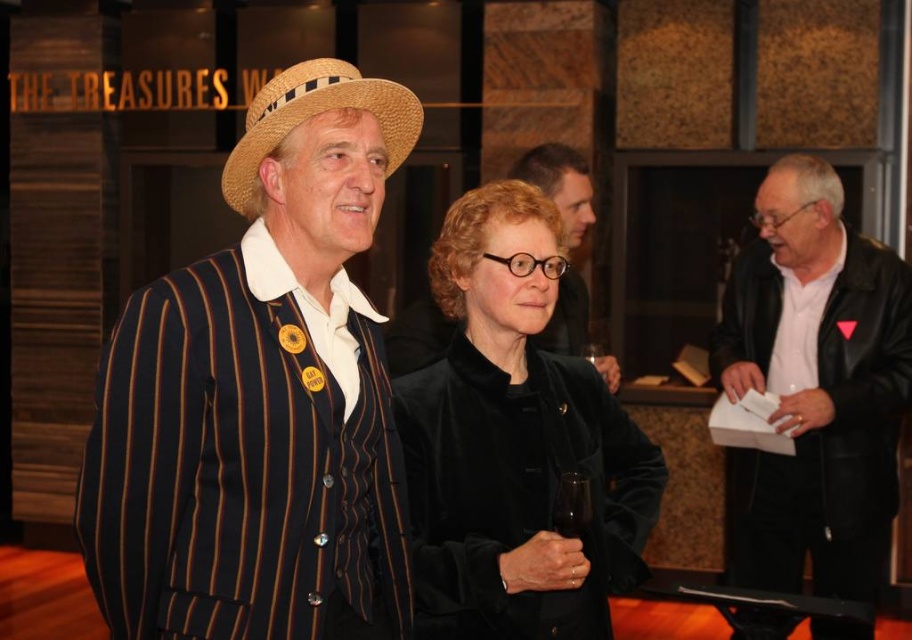
Question: Which object is closer to the camera taking this photo?

Choices:
 (A) strawhat at center
 (B) velvet black jacket at center
 (C) black leather jacket at right

Answer: (A)

Question: Is striped fabric suit at center to the right of velvet black jacket at center from the viewer's perspective?

Choices:
 (A) no
 (B) yes

Answer: (A)

Question: Which object is closer to the camera taking this photo?

Choices:
 (A) black leather jacket at right
 (B) strawhat at center
 (C) striped fabric suit at center
 (D) matte black jacket at center

Answer: (C)

Question: Among these objects, which one is farthest from the camera?

Choices:
 (A) striped fabric suit at center
 (B) strawhat at center
 (C) velvet black jacket at center
 (D) matte black jacket at center

Answer: (D)

Question: Does matte black jacket at center appear on the right side of transparent glass at center?

Choices:
 (A) yes
 (B) no

Answer: (A)

Question: Is velvet black jacket at center positioned before strawhat at center?

Choices:
 (A) yes
 (B) no

Answer: (B)